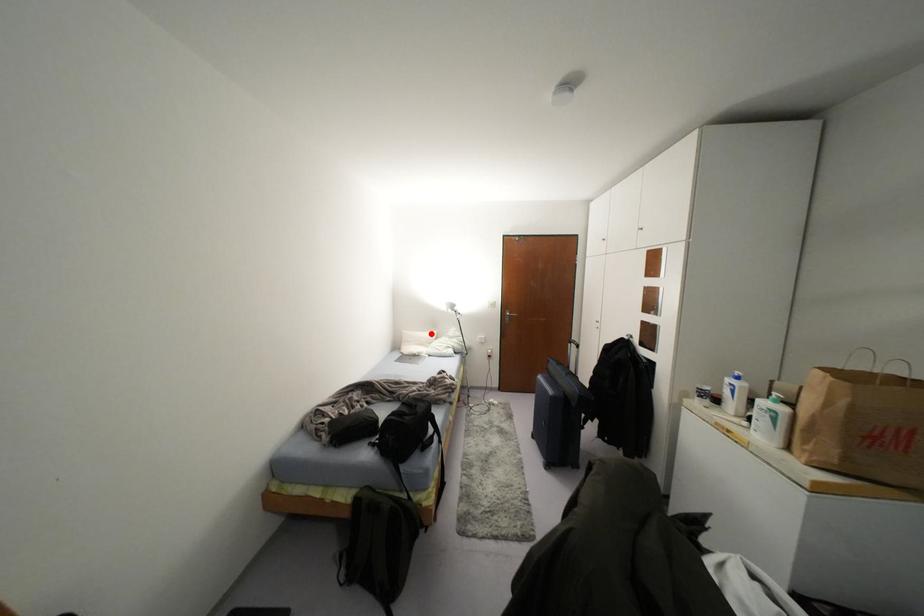
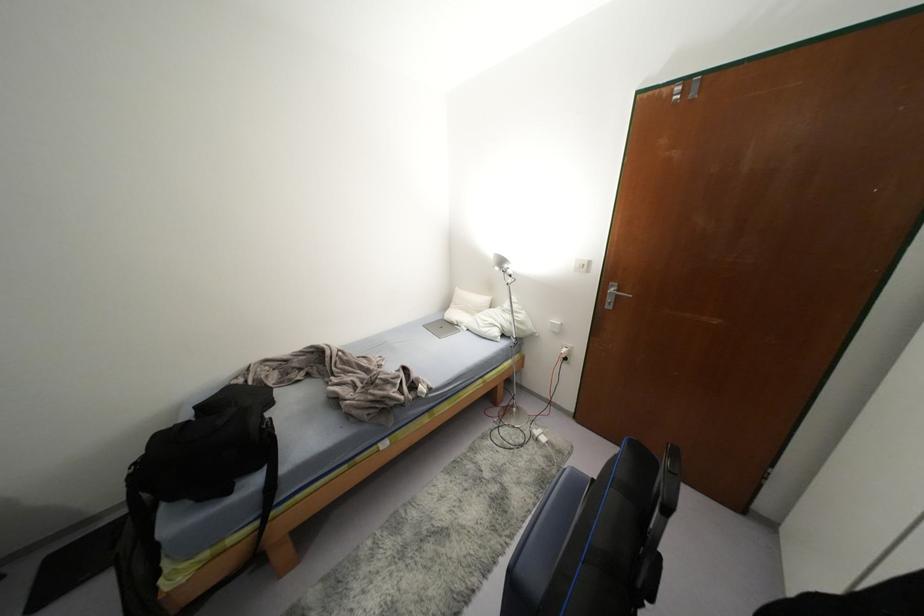
In the second image, find the point that corresponds to the highlighted location in the first image.

(484, 299)